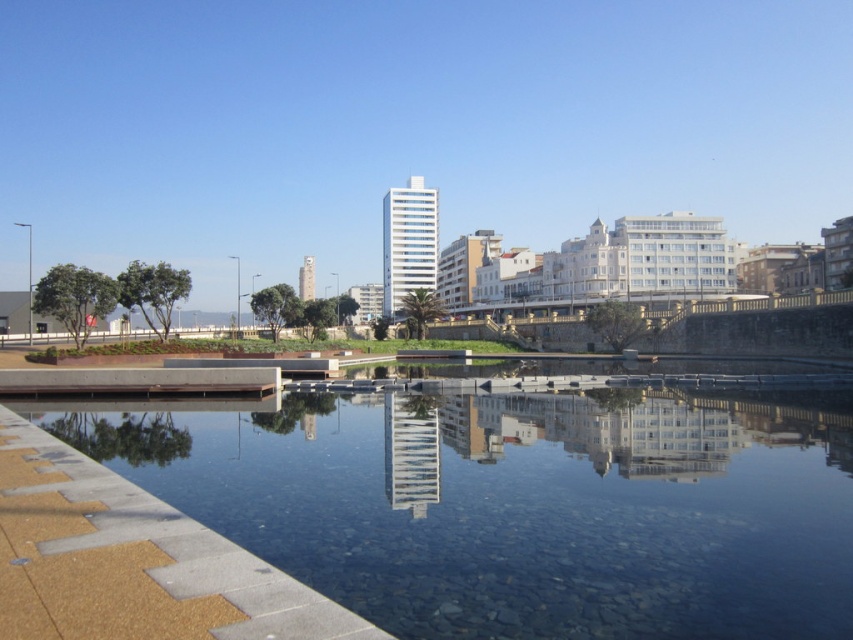
Question: Considering the relative positions of smooth concrete river at center and brown textured paving at lower left in the image provided, where is smooth concrete river at center located with respect to brown textured paving at lower left?

Choices:
 (A) below
 (B) above

Answer: (A)

Question: Is smooth concrete river at center to the right of brown textured paving at lower left from the viewer's perspective?

Choices:
 (A) no
 (B) yes

Answer: (B)

Question: Among these objects, which one is farthest from the camera?

Choices:
 (A) brown textured paving at lower left
 (B) smooth concrete river at center

Answer: (B)

Question: Can you confirm if smooth concrete river at center is bigger than brown textured paving at lower left?

Choices:
 (A) no
 (B) yes

Answer: (B)

Question: Among these points, which one is nearest to the camera?

Choices:
 (A) (569, 413)
 (B) (229, 548)

Answer: (B)